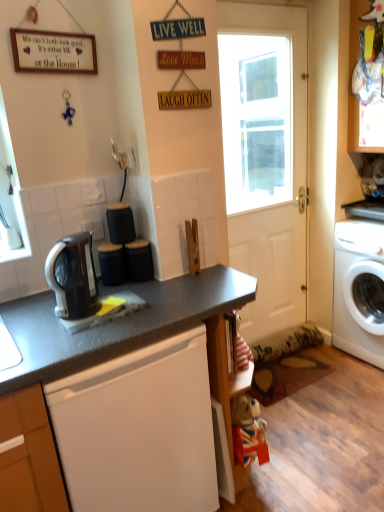
Locate an element on the screen. The image size is (384, 512). blank space situated above matte black countertop at center (from a real-world perspective) is located at coordinates (145, 295).